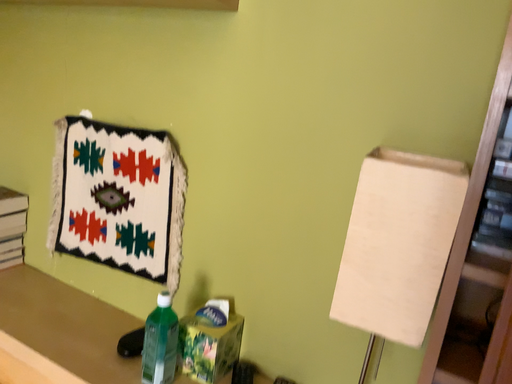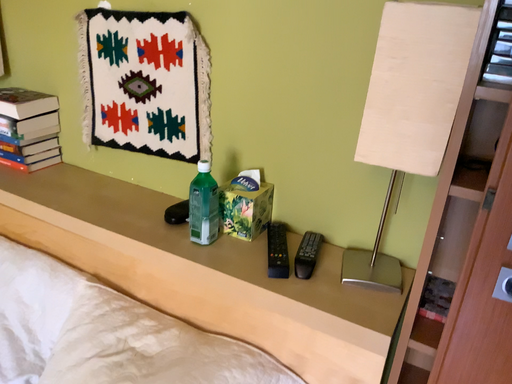
Question: Which way did the camera rotate in the video?

Choices:
 (A) rotated upward
 (B) rotated downward

Answer: (B)